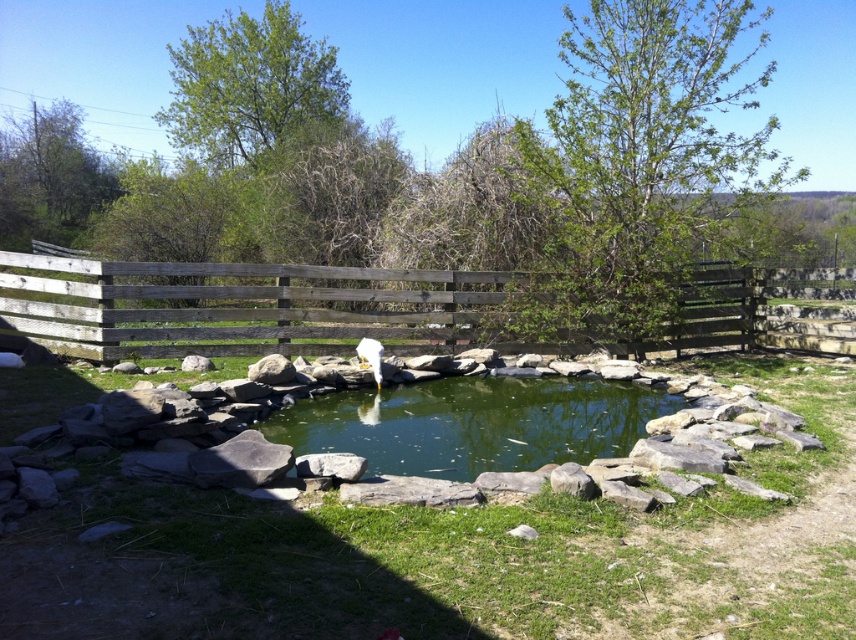
Question: Can you confirm if green liquid water at center is bigger than white fluffy bird at center?

Choices:
 (A) yes
 (B) no

Answer: (A)

Question: Which point is farther to the camera?

Choices:
 (A) (581, 348)
 (B) (330, 412)
 (C) (364, 360)

Answer: (A)

Question: Does green liquid water at center appear on the left side of white fluffy bird at center?

Choices:
 (A) yes
 (B) no

Answer: (B)

Question: Where is wooden fence at center located in relation to white fluffy bird at center in the image?

Choices:
 (A) left
 (B) right

Answer: (B)

Question: Which object is positioned farthest from the wooden fence at center?

Choices:
 (A) white fluffy bird at center
 (B) green liquid water at center

Answer: (A)

Question: Which object is positioned closest to the green liquid water at center?

Choices:
 (A) wooden fence at center
 (B) white fluffy bird at center

Answer: (B)